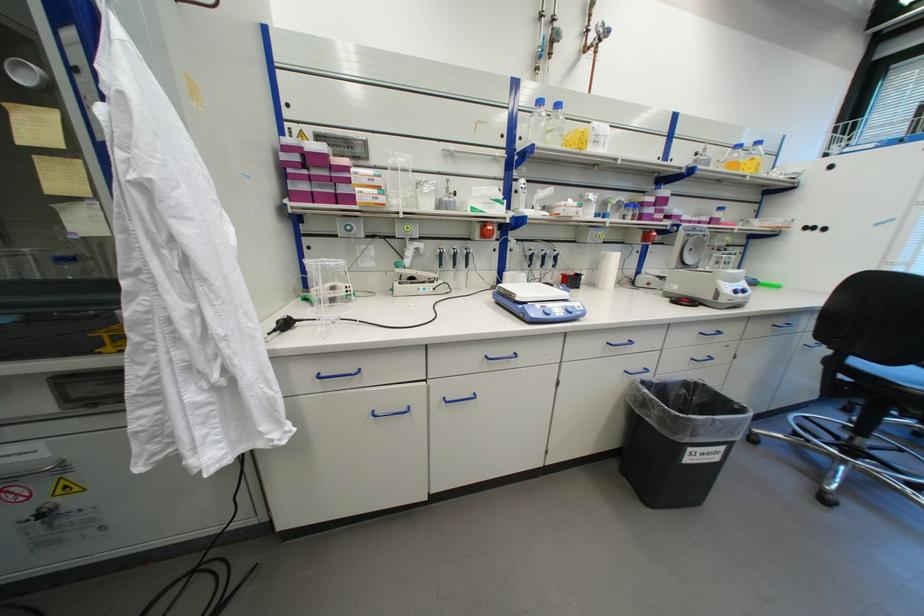
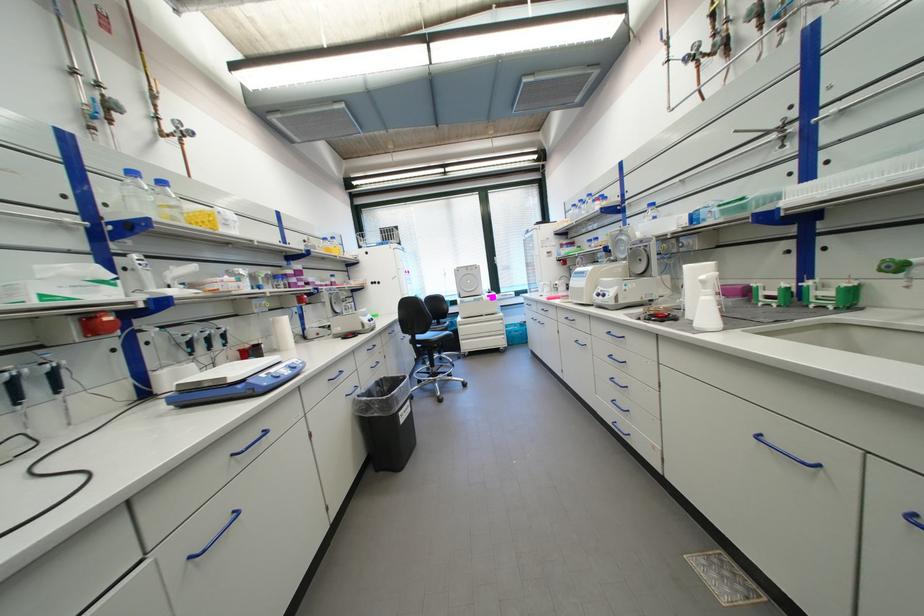
In the second image, find the point that corresponds to [492,236] in the first image.

(101, 331)